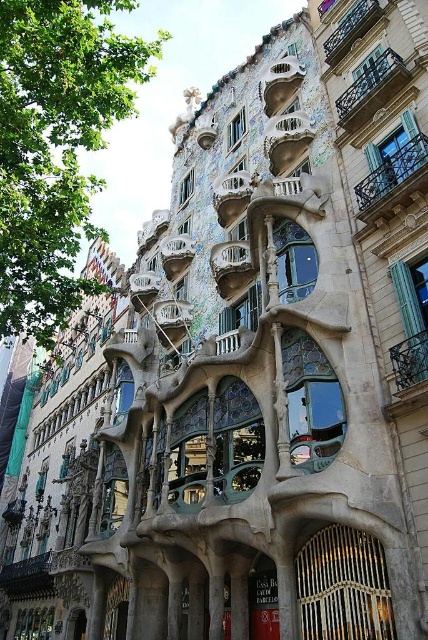
Measure the distance from polished bronze balcony at upper right to dark brown wrought iron balcony at upper center.

polished bronze balcony at upper right and dark brown wrought iron balcony at upper center are 9.81 meters apart.

Can you confirm if polished bronze balcony at upper right is bigger than dark brown wrought iron balcony at upper center?

Actually, polished bronze balcony at upper right might be smaller than dark brown wrought iron balcony at upper center.

Is point (401, 86) positioned in front of point (347, 45)?

Yes, point (401, 86) is closer to viewer.

Find the location of `polished bronze balcony at upper right`. polished bronze balcony at upper right is located at coordinates (371, 90).

Which is in front, point (424, 172) or point (388, 84)?

Positioned in front is point (424, 172).

At what (x,y) coordinates should I click in order to perform the action: click on iron forged balcony at upper right. Please return your answer as a coordinate pair (x, y). Looking at the image, I should click on (394, 180).

Is point (380, 177) positioned before point (380, 8)?

Yes, it is in front of point (380, 8).

Which is behind, point (407, 148) or point (372, 1)?

The point (372, 1) is behind.

The image size is (428, 640). Identify the location of iron forged balcony at upper right. (394, 180).